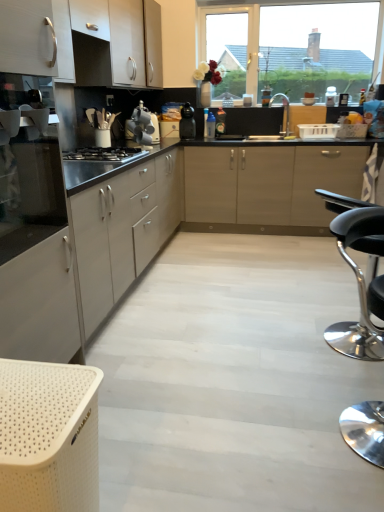
Locate an element on the screen. white plastic toaster at center is located at coordinates (155, 128).

Locate an element on the screen. The width and height of the screenshot is (384, 512). transparent glass window at upper center is located at coordinates (293, 47).

Describe the element at coordinates (27, 38) in the screenshot. I see `white matte cabinet at upper left, which appears as the 2th cabinetry when viewed from the top` at that location.

Describe the element at coordinates (358, 275) in the screenshot. I see `black leather stool at lower right` at that location.

Identify the location of black matte gas stove at center. This screenshot has width=384, height=512. (106, 154).

Find the location of a particular element. white plastic toaster at center is located at coordinates (155, 128).

Identify the location of oven in front of the black matte gas stove at center. This screenshot has width=384, height=512. (30, 186).

Is satin silver oven at left not within black matte gas stove at center?

Yes, satin silver oven at left is not within black matte gas stove at center.

Is satin silver oven at left to the left of black matte gas stove at center from the viewer's perspective?

Yes.

Is satin silver oven at left positioned far away from black matte gas stove at center?

satin silver oven at left is near black matte gas stove at center, not far away.

Consider the image. From the image's perspective, which one is positioned lower, black leather stool at lower right or black matte coffee maker at center, the second kitchen appliance when ordered from front to back?

black leather stool at lower right.

Where is `chair on the right of black matte coffee maker at center, the second kitchen appliance from the left`? chair on the right of black matte coffee maker at center, the second kitchen appliance from the left is located at coordinates (358, 275).

Considering the relative sizes of black leather stool at lower right and black matte coffee maker at center, placed as the first kitchen appliance when sorted from back to front, in the image provided, is black leather stool at lower right wider than black matte coffee maker at center, placed as the first kitchen appliance when sorted from back to front,?

Yes.

Can you tell me how much black leather stool at lower right and black matte coffee maker at center, the second kitchen appliance from the left, differ in facing direction?

The facing directions of black leather stool at lower right and black matte coffee maker at center, the second kitchen appliance from the left, are 5.38 degrees apart.

From the image's perspective, is matte white cabinet at upper left, marked as the third cabinetry in a bottom-to-top arrangement, beneath silver metallic faucet at center?

Incorrect, from the image's perspective, matte white cabinet at upper left, marked as the third cabinetry in a bottom-to-top arrangement, is higher than silver metallic faucet at center.

Measure the distance between matte white cabinet at upper left, marked as the third cabinetry in a bottom-to-top arrangement, and silver metallic faucet at center.

matte white cabinet at upper left, marked as the third cabinetry in a bottom-to-top arrangement, and silver metallic faucet at center are 5.64 feet apart from each other.

From a real-world perspective, who is located lower, matte white cabinet at upper left, arranged as the first cabinetry when viewed from the top, or silver metallic faucet at center?

In real-world perspective, silver metallic faucet at center is lower.

From the picture: Between matte white cabinet at upper left, marked as the third cabinetry in a bottom-to-top arrangement, and silver metallic faucet at center, which one has smaller size?

With smaller size is silver metallic faucet at center.

In the scene shown: Is white matte cabinet at upper left, which appears as the 2th cabinetry when viewed from the top, outside of satin silver kettle at center, arranged as the 1th kitchen appliance when viewed from the front?

Absolutely, white matte cabinet at upper left, which appears as the 2th cabinetry when viewed from the top, is external to satin silver kettle at center, arranged as the 1th kitchen appliance when viewed from the front.

Is white matte cabinet at upper left, the second cabinetry when ordered from bottom to top, turned away from satin silver kettle at center, arranged as the 1th kitchen appliance when viewed from the front?

No.

From the image's perspective, relative to satin silver kettle at center, arranged as the 1th kitchen appliance when viewed from the front, is white matte cabinet at upper left, which appears as the 2th cabinetry when viewed from the top, above or below?

white matte cabinet at upper left, which appears as the 2th cabinetry when viewed from the top, is situated higher than satin silver kettle at center, arranged as the 1th kitchen appliance when viewed from the front, in the image.

Considering the relative sizes of matte white cabinet at upper left, marked as the third cabinetry in a bottom-to-top arrangement, and white plastic toaster at center in the image provided, is matte white cabinet at upper left, marked as the third cabinetry in a bottom-to-top arrangement, shorter than white plastic toaster at center?

Incorrect, the height of matte white cabinet at upper left, marked as the third cabinetry in a bottom-to-top arrangement, does not fall short of that of white plastic toaster at center.

Looking at this image, between matte white cabinet at upper left, arranged as the first cabinetry when viewed from the top, and white plastic toaster at center, which one has larger size?

matte white cabinet at upper left, arranged as the first cabinetry when viewed from the top.

Which object is more forward, matte white cabinet at upper left, arranged as the first cabinetry when viewed from the top, or white plastic toaster at center?

matte white cabinet at upper left, arranged as the first cabinetry when viewed from the top.

Which is more to the left, black matte coffee maker at center, which appears as the first kitchen appliance when viewed from the right, or satin silver oven at left?

satin silver oven at left.

Between black matte coffee maker at center, placed as the first kitchen appliance when sorted from back to front, and satin silver oven at left, which one is positioned in front?

satin silver oven at left.

Considering the points (183, 127) and (27, 221), which point is in front, point (183, 127) or point (27, 221)?

The point (27, 221) is closer to the camera.

Based on the photo, could you measure the distance between black matte coffee maker at center, the second kitchen appliance from the left, and satin silver oven at left?

The distance of black matte coffee maker at center, the second kitchen appliance from the left, from satin silver oven at left is 2.95 meters.

Are black matte coffee maker at center, the second kitchen appliance from the left, and white plastic toaster at center located far from each other?

black matte coffee maker at center, the second kitchen appliance from the left, is positioned a significant distance from white plastic toaster at center.

In terms of height, does black matte coffee maker at center, the second kitchen appliance when ordered from front to back, look taller or shorter compared to white plastic toaster at center?

In the image, black matte coffee maker at center, the second kitchen appliance when ordered from front to back, appears to be taller than white plastic toaster at center.

Could you tell me if black matte coffee maker at center, which appears as the first kitchen appliance when viewed from the right, is turned towards white plastic toaster at center?

No, black matte coffee maker at center, which appears as the first kitchen appliance when viewed from the right, is not oriented towards white plastic toaster at center.

Looking at this image, from the image's perspective, would you say black matte coffee maker at center, the second kitchen appliance when ordered from front to back, is positioned over white plastic toaster at center?

Yes.

Where is `gas stove that is above the satin silver oven at left (from the image's perspective)`? This screenshot has width=384, height=512. gas stove that is above the satin silver oven at left (from the image's perspective) is located at coordinates (106, 154).

In the image, there is a black matte coffee maker at center, the second kitchen appliance from the left. Find the location of `chair below it (from a real-world perspective)`. chair below it (from a real-world perspective) is located at coordinates (358, 275).

From the image, which object appears to be farther from white matte cabinet at left, which is the first cabinetry from bottom to top, black matte coffee maker at center, placed as the first kitchen appliance when sorted from back to front, or black leather stool at lower right?

The object further to white matte cabinet at left, which is the first cabinetry from bottom to top, is black matte coffee maker at center, placed as the first kitchen appliance when sorted from back to front.

Looking at the image, which one is located further to transparent glass window at upper center, satin silver oven at left or black matte coffee maker at center, the second kitchen appliance when ordered from front to back?

satin silver oven at left is further to transparent glass window at upper center.

Based on their spatial positions, is white plastic toaster at center or satin silver oven at left closer to black matte gas stove at center?

white plastic toaster at center is positioned closer to the anchor black matte gas stove at center.

When comparing their distances from black matte coffee maker at center, which appears as the first kitchen appliance when viewed from the right, does silver metallic faucet at center or transparent glass window at upper center seem further?

transparent glass window at upper center is further to black matte coffee maker at center, which appears as the first kitchen appliance when viewed from the right.

Estimate the real-world distances between objects in this image. Which object is closer to satin silver oven at left, transparent glass window at upper center or beige perforated basket at lower left?

Among the two, beige perforated basket at lower left is located nearer to satin silver oven at left.

Looking at the image, which one is located further to black leather stool at lower right, white matte cabinet at left, which is the first cabinetry from bottom to top, or beige perforated basket at lower left?

Among the two, beige perforated basket at lower left is located further to black leather stool at lower right.

Based on their spatial positions, is black matte gas stove at center or satin silver oven at left closer to white matte cabinet at left, which is the first cabinetry from bottom to top?

The object closer to white matte cabinet at left, which is the first cabinetry from bottom to top, is satin silver oven at left.

In the scene shown: From the image, which object appears to be nearer to black matte gas stove at center, white matte cabinet at left, the third cabinetry when ordered from top to bottom, or satin silver oven at left?

Among the two, white matte cabinet at left, the third cabinetry when ordered from top to bottom, is located nearer to black matte gas stove at center.

I want to click on chair between satin silver oven at left and satin silver kettle at center, arranged as the 1th kitchen appliance when viewed from the front, from front to back, so click(x=358, y=275).

Where is `oven positioned between beige perforated basket at lower left and black matte coffee maker at center, the second kitchen appliance from the left, from near to far`? Image resolution: width=384 pixels, height=512 pixels. oven positioned between beige perforated basket at lower left and black matte coffee maker at center, the second kitchen appliance from the left, from near to far is located at coordinates (30, 186).

The width and height of the screenshot is (384, 512). What are the coordinates of `appliance located between black matte gas stove at center and silver metallic faucet at center in the left-right direction` in the screenshot? It's located at (155, 128).

Locate an element on the screen. The height and width of the screenshot is (512, 384). gas stove between white matte cabinet at upper left, the second cabinetry when ordered from bottom to top, and black matte coffee maker at center, the second kitchen appliance from the left, from front to back is located at coordinates (106, 154).